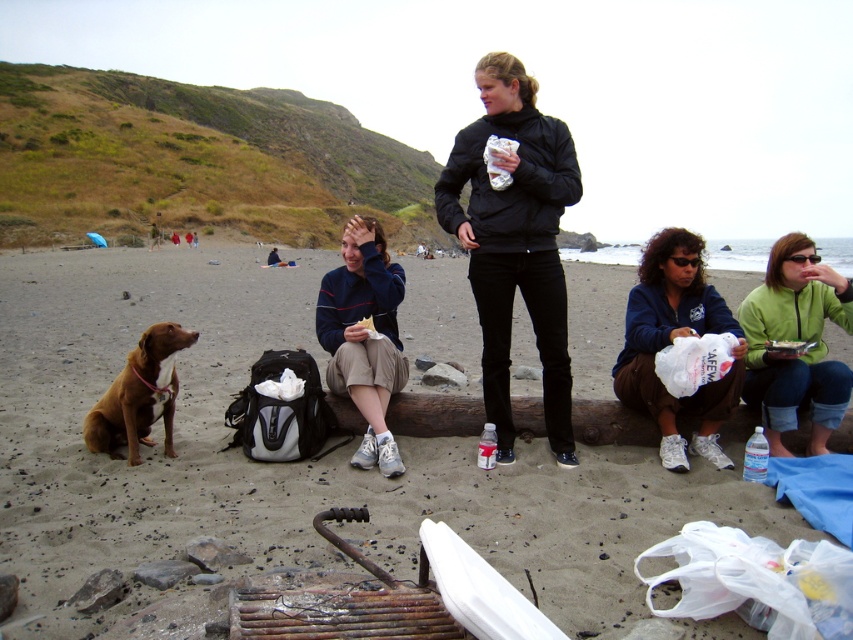
Question: Which object is closer to the camera taking this photo?

Choices:
 (A) brown sandy beach at center
 (B) black matte jacket at center

Answer: (A)

Question: Which point is farther from the camera taking this photo?

Choices:
 (A) (535, 92)
 (B) (764, 346)

Answer: (B)

Question: From the image, what is the correct spatial relationship of brown sandy beach at center in relation to black matte jacket at center?

Choices:
 (A) left
 (B) right

Answer: (A)

Question: Where is brown sandy beach at center located in relation to brown fur dog at lower left in the image?

Choices:
 (A) below
 (B) above

Answer: (B)

Question: Can you confirm if black matte jacket at center is positioned to the right of brown fur dog at lower left?

Choices:
 (A) no
 (B) yes

Answer: (B)

Question: Estimate the real-world distances between objects in this image. Which object is farther from the blue fleece jacket at lower right?

Choices:
 (A) blue fleece jacket at center
 (B) black matte jacket at center
 (C) brown sandy beach at center

Answer: (C)